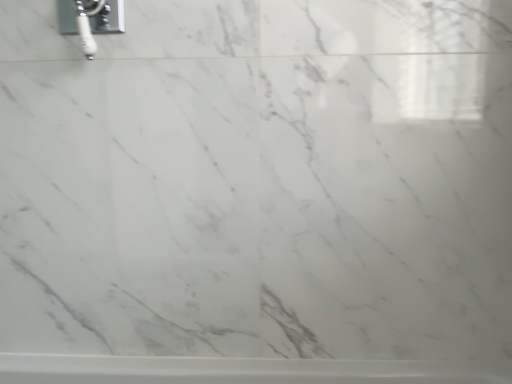
Question: Considering the relative sizes of white glossy bathtub at lower center and chrome metallic faucet at upper left in the image provided, is white glossy bathtub at lower center wider than chrome metallic faucet at upper left?

Choices:
 (A) no
 (B) yes

Answer: (B)

Question: Is white glossy bathtub at lower center next to chrome metallic faucet at upper left and touching it?

Choices:
 (A) no
 (B) yes

Answer: (A)

Question: Considering the relative sizes of white glossy bathtub at lower center and chrome metallic faucet at upper left in the image provided, is white glossy bathtub at lower center thinner than chrome metallic faucet at upper left?

Choices:
 (A) no
 (B) yes

Answer: (A)

Question: From a real-world perspective, is white glossy bathtub at lower center positioned over chrome metallic faucet at upper left based on gravity?

Choices:
 (A) no
 (B) yes

Answer: (A)

Question: Would you say white glossy bathtub at lower center is outside chrome metallic faucet at upper left?

Choices:
 (A) yes
 (B) no

Answer: (A)

Question: From a real-world perspective, is white glossy bathtub at lower center physically below chrome metallic faucet at upper left?

Choices:
 (A) yes
 (B) no

Answer: (A)

Question: Is the surface of chrome metallic faucet at upper left in direct contact with white glossy bathtub at lower center?

Choices:
 (A) yes
 (B) no

Answer: (B)

Question: Is chrome metallic faucet at upper left shorter than white glossy bathtub at lower center?

Choices:
 (A) no
 (B) yes

Answer: (A)

Question: Considering the relative sizes of chrome metallic faucet at upper left and white glossy bathtub at lower center in the image provided, is chrome metallic faucet at upper left thinner than white glossy bathtub at lower center?

Choices:
 (A) no
 (B) yes

Answer: (B)

Question: Is chrome metallic faucet at upper left aimed at white glossy bathtub at lower center?

Choices:
 (A) no
 (B) yes

Answer: (A)

Question: Considering the relative sizes of chrome metallic faucet at upper left and white glossy bathtub at lower center in the image provided, is chrome metallic faucet at upper left taller than white glossy bathtub at lower center?

Choices:
 (A) no
 (B) yes

Answer: (B)

Question: Is chrome metallic faucet at upper left completely or partially outside of white glossy bathtub at lower center?

Choices:
 (A) no
 (B) yes

Answer: (B)

Question: From the image's perspective, is chrome metallic faucet at upper left above or below white glossy bathtub at lower center?

Choices:
 (A) above
 (B) below

Answer: (A)